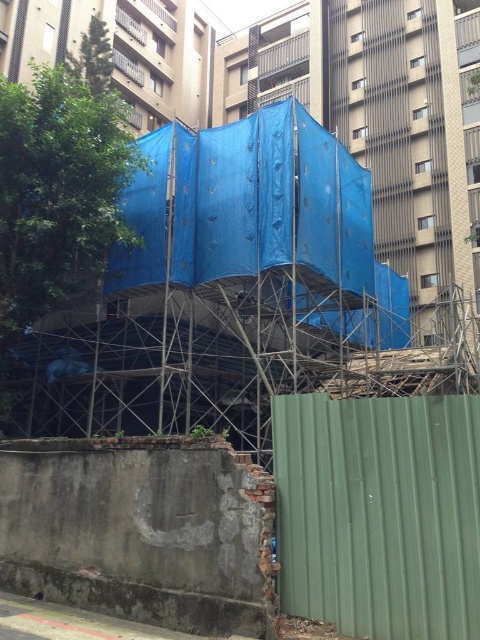
Question: Can you confirm if green corrugated metal fence at lower right is bigger than metallic scaffolding at center?

Choices:
 (A) no
 (B) yes

Answer: (B)

Question: Among these points, which one is nearest to the camera?

Choices:
 (A) (336, 422)
 (B) (54, 369)

Answer: (A)

Question: Can you confirm if green corrugated metal fence at lower right is positioned to the right of metallic scaffolding at center?

Choices:
 (A) yes
 (B) no

Answer: (A)

Question: Does green corrugated metal fence at lower right appear over metallic scaffolding at center?

Choices:
 (A) yes
 (B) no

Answer: (B)